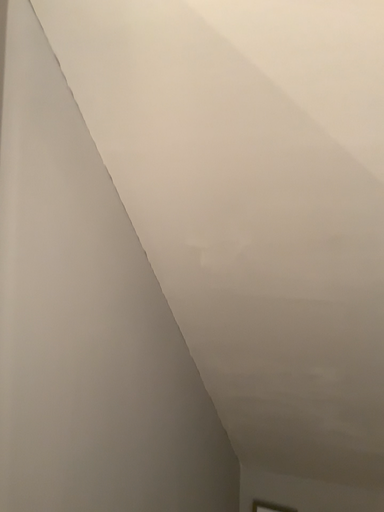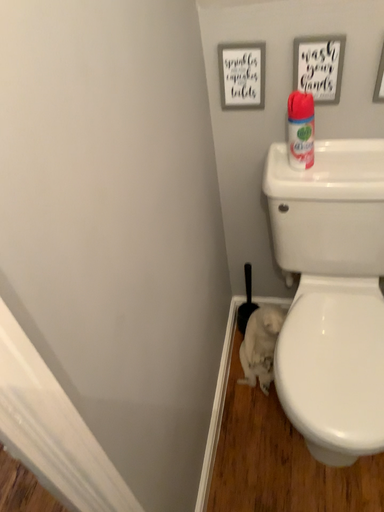
Question: How did the camera likely rotate when shooting the video?

Choices:
 (A) rotated right
 (B) rotated left

Answer: (A)